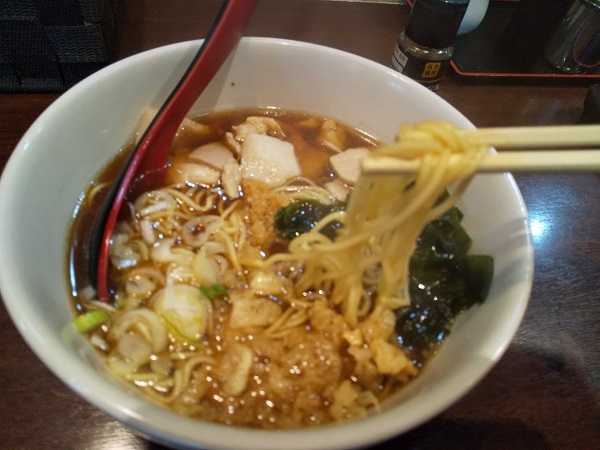
The height and width of the screenshot is (450, 600). I want to click on tray edge, so click(x=460, y=73).